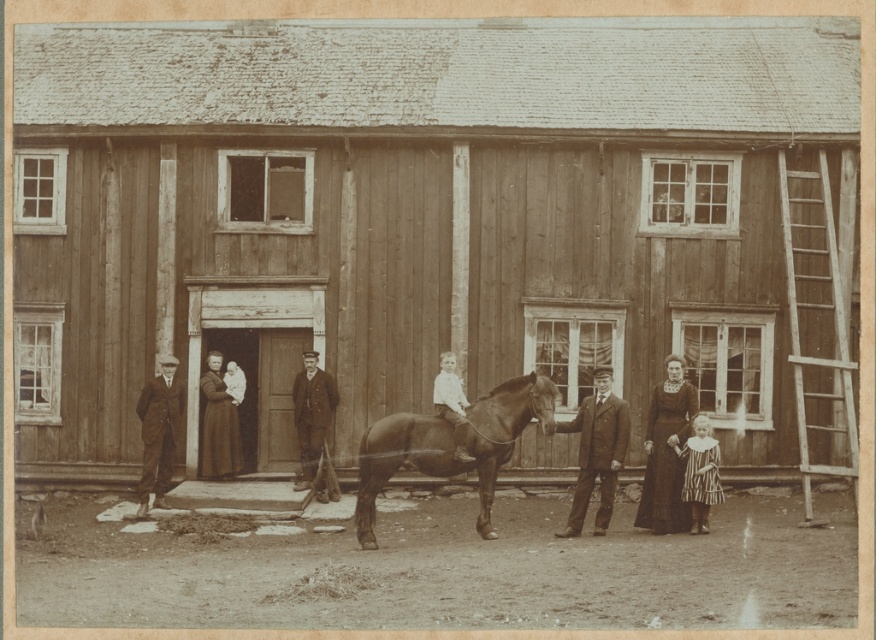
The width and height of the screenshot is (876, 640). Identify the location of wooden ladder at right. (816, 324).

Measure the distance between wooden ladder at right and camera.

wooden ladder at right and camera are 19.61 meters apart from each other.

Is point (804, 304) farther from viewer compared to point (669, 435)?

Yes, point (804, 304) is farther from viewer.

Where is `wooden ladder at right`? This screenshot has width=876, height=640. wooden ladder at right is located at coordinates (816, 324).

Is point (152, 426) behind point (232, 420)?

No, it is not.

Between point (168, 368) and point (232, 474), which one is positioned in front?

Point (168, 368) is in front.

What are the coordinates of `dark brown suit at left` in the screenshot? It's located at (157, 435).

Is brown glossy horse at center wider than dark brown suit at left?

Indeed, brown glossy horse at center has a greater width compared to dark brown suit at left.

In the scene shown: Is brown glossy horse at center above dark brown suit at left?

Actually, brown glossy horse at center is below dark brown suit at left.

The image size is (876, 640). What are the coordinates of `brown glossy horse at center` in the screenshot? It's located at (451, 445).